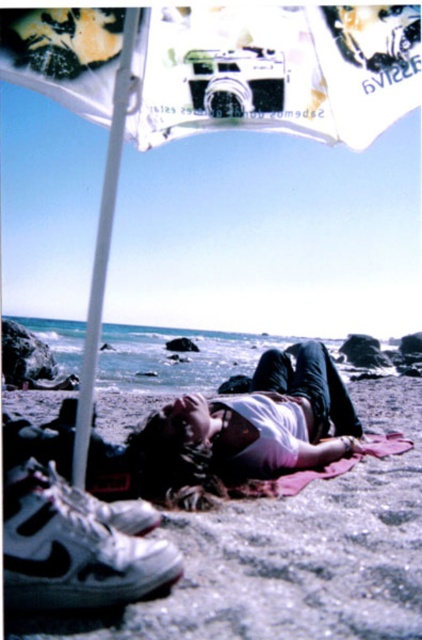
You are standing at the camera position and want to reach point (392, 492). Is the distance less than 15 feet?

The distance between point (392, 492) and the camera is 10.87 feet, which is less than 15 feet.

You are a beachgoer who wants to place a small bag on the sand. The smooth sand at lower center is under the pink fabric at lower center. Where should you place the bag to ensure it stays on the sand and not on the pink fabric?

Place the bag on the smooth sand at lower center that is positioned under the pink fabric at lower center, ensuring it is not on top of the fabric.

You are planning to set up a small tent on the beach. The tent requires a space that is wider than the smooth sand at lower center. Do you think the pink fabric at lower center can provide enough width for the tent?

The smooth sand at lower center has a smaller width than the pink fabric at lower center. Since the tent requires a space wider than the smooth sand, the pink fabric at lower center can provide sufficient width for the tent.